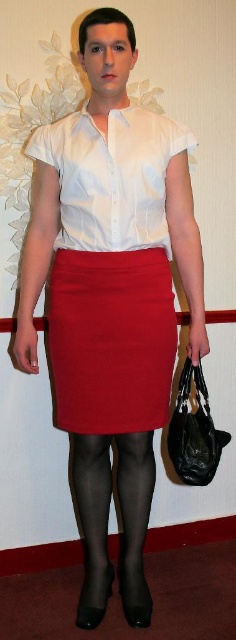
Question: Which point appears farthest from the camera in this image?

Choices:
 (A) (89, 524)
 (B) (147, 380)
 (C) (112, 140)

Answer: (A)

Question: Does matte red skirt at center have a greater width compared to black sheer tights at lower center?

Choices:
 (A) no
 (B) yes

Answer: (B)

Question: Which object is positioned farthest from the white glossy shirt at center?

Choices:
 (A) matte red skirt at center
 (B) black sheer tights at lower center

Answer: (B)

Question: Observing the image, what is the correct spatial positioning of white glossy shirt at center in reference to black sheer tights at lower center?

Choices:
 (A) below
 (B) above

Answer: (B)

Question: Which is farther from the white glossy shirt at center?

Choices:
 (A) black sheer tights at lower center
 (B) matte red skirt at center

Answer: (A)

Question: Observing the image, what is the correct spatial positioning of white glossy shirt at center in reference to black sheer tights at lower center?

Choices:
 (A) right
 (B) left

Answer: (A)